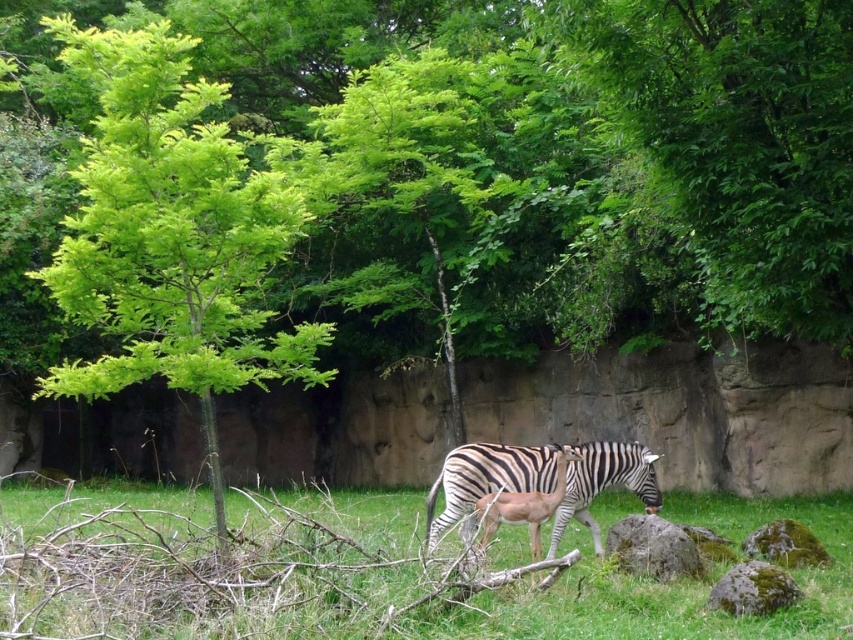
Question: Which object is the closest to the green grass at center?

Choices:
 (A) smooth gray rock at center
 (B) black and white striped zebra at center

Answer: (B)

Question: Does green leafy tree at center lie behind smooth gray rock at center?

Choices:
 (A) no
 (B) yes

Answer: (A)

Question: Which object appears farthest from the camera in this image?

Choices:
 (A) green grass at center
 (B) green mossy rock at lower right
 (C) smooth brown antelope at center

Answer: (C)

Question: Among these objects, which one is farthest from the camera?

Choices:
 (A) green mossy rock at lower right
 (B) green mossy rock at center
 (C) green leafy tree at center

Answer: (B)

Question: Is green leafy tree at center thinner than smooth brown antelope at center?

Choices:
 (A) no
 (B) yes

Answer: (B)

Question: Is green grass at center closer to camera compared to smooth gray rock at center?

Choices:
 (A) yes
 (B) no

Answer: (A)